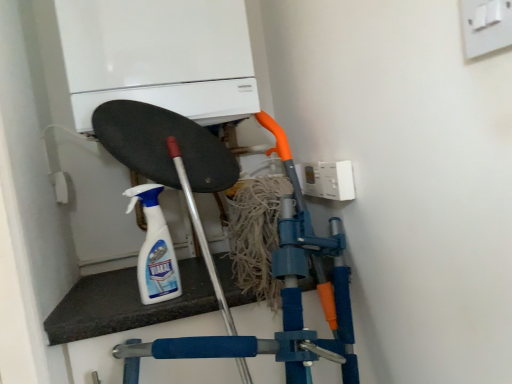
Question: Is white matte boiler at upper center further to camera compared to white plastic spray bottle at center?

Choices:
 (A) no
 (B) yes

Answer: (B)

Question: Does white matte boiler at upper center have a lesser width compared to white plastic spray bottle at center?

Choices:
 (A) no
 (B) yes

Answer: (A)

Question: Is the position of white matte boiler at upper center less distant than that of white plastic spray bottle at center?

Choices:
 (A) no
 (B) yes

Answer: (A)

Question: From the image's perspective, does white matte boiler at upper center appear higher than white plastic spray bottle at center?

Choices:
 (A) yes
 (B) no

Answer: (A)

Question: Does white matte boiler at upper center appear on the right side of white plastic spray bottle at center?

Choices:
 (A) yes
 (B) no

Answer: (B)

Question: Is white plastic switch at upper right, marked as the second electric outlet in a bottom-to-top arrangement, wider or thinner than white matte boiler at upper center?

Choices:
 (A) wide
 (B) thin

Answer: (B)

Question: From the image's perspective, is white plastic switch at upper right, marked as the 2th electric outlet in a back-to-front arrangement, located above or below white matte boiler at upper center?

Choices:
 (A) below
 (B) above

Answer: (A)

Question: Is white plastic switch at upper right, marked as the 2th electric outlet in a back-to-front arrangement, in front of or behind white matte boiler at upper center in the image?

Choices:
 (A) behind
 (B) front

Answer: (B)

Question: Does point (487, 48) appear closer or farther from the camera than point (108, 31)?

Choices:
 (A) farther
 (B) closer

Answer: (B)

Question: In the image, is white plastic spray bottle at center positioned in front of or behind white plastic switch at upper right, the first electric outlet in the right-to-left sequence?

Choices:
 (A) behind
 (B) front

Answer: (A)

Question: Considering the positions of white plastic spray bottle at center and white plastic switch at upper right, the first electric outlet from the top, in the image, is white plastic spray bottle at center taller or shorter than white plastic switch at upper right, the first electric outlet from the top,?

Choices:
 (A) tall
 (B) short

Answer: (A)

Question: In terms of size, does white plastic spray bottle at center appear bigger or smaller than white plastic switch at upper right, the first electric outlet from the top?

Choices:
 (A) big
 (B) small

Answer: (A)

Question: In terms of width, does white plastic spray bottle at center look wider or thinner when compared to white plastic switch at upper right, the second electric outlet positioned from the left?

Choices:
 (A) thin
 (B) wide

Answer: (B)

Question: From a real-world perspective, is white plastic spray bottle at center positioned above or below white plastic electric outlet at upper right, which appears as the first electric outlet when ordered from the bottom?

Choices:
 (A) below
 (B) above

Answer: (A)

Question: From the image's perspective, is white plastic spray bottle at center above or below white plastic electric outlet at upper right, arranged as the 1th electric outlet when viewed from the left?

Choices:
 (A) above
 (B) below

Answer: (B)